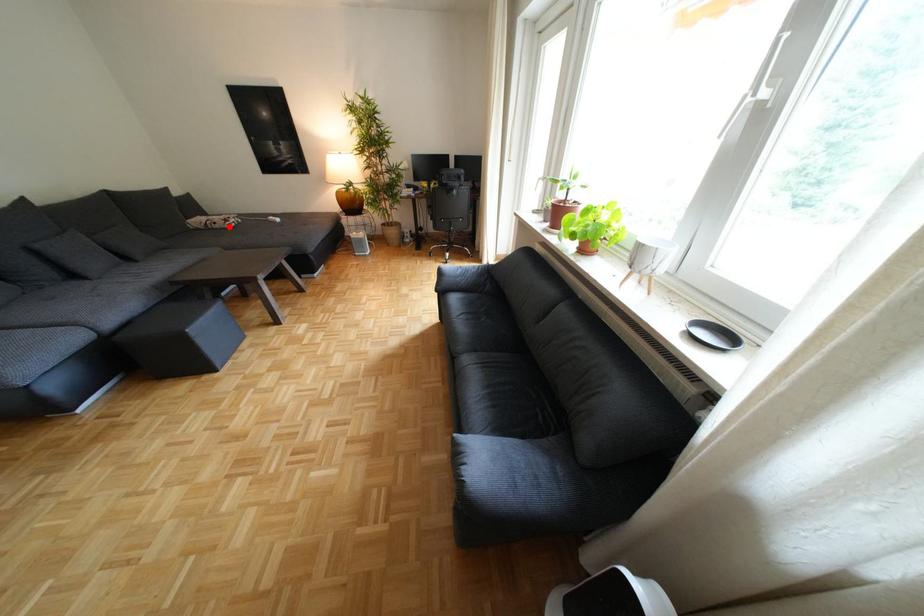
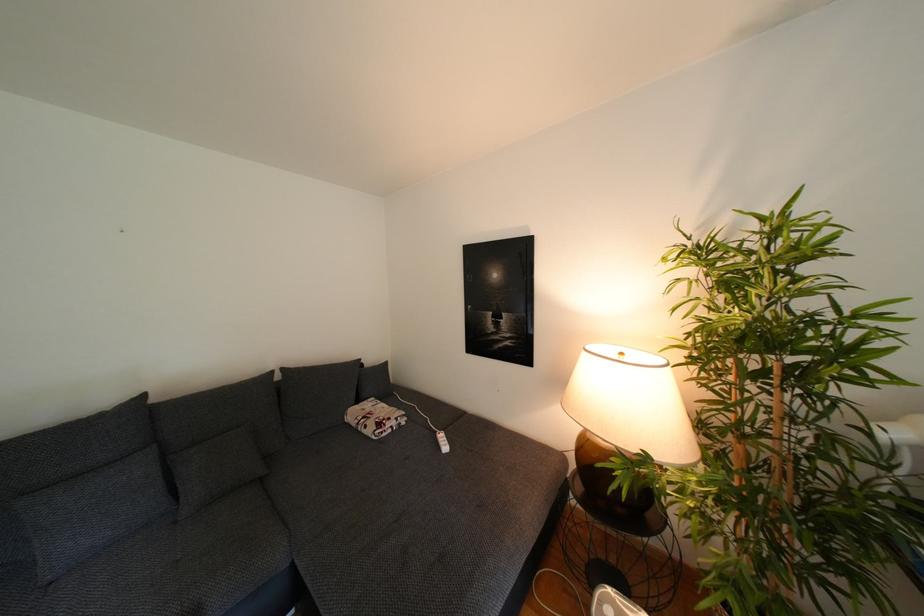
Locate, in the second image, the point that corresponds to the highlighted location in the first image.

(378, 431)